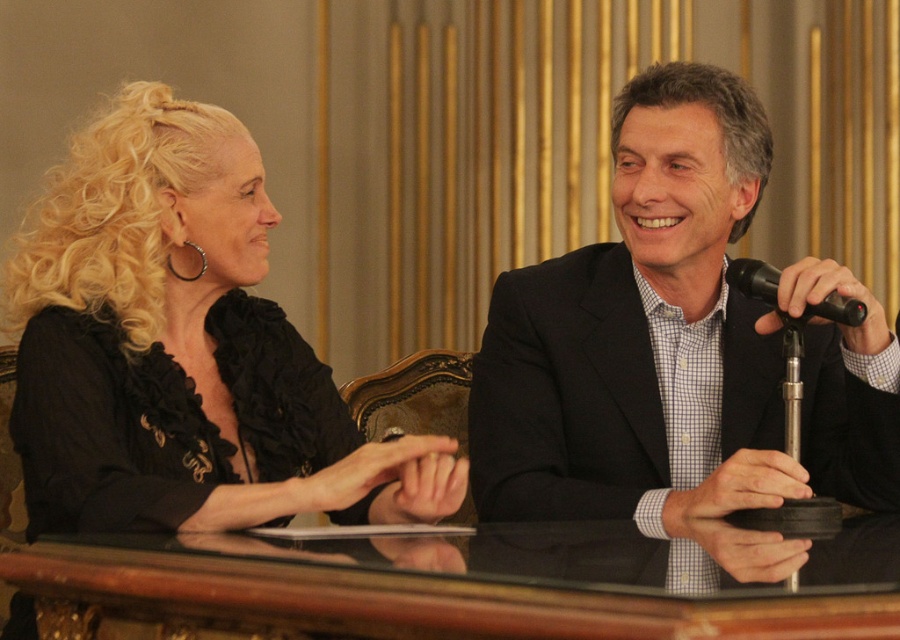
Consider the image. You are a photographer setting up for a formal event. You need to position a camera to capture both the black matte suit at center and the transparent glass table at center clearly. Based on their positions, which object should be focused on first to ensure proper depth of field?

The black matte suit at center is above the transparent glass table at center, so focusing on the black matte suit at center first will ensure proper depth of field as it is closer to the camera.

You are a photographer standing at point (398, 508). You need to take a photo of the two people in the scene. Can you fit both of them in the frame if your camera has a 90 degree field of view?

The two people are 2.07 meters apart. At a 90 degree field of view, the camera can capture a wider angle, so yes, you can fit both of them in the frame.